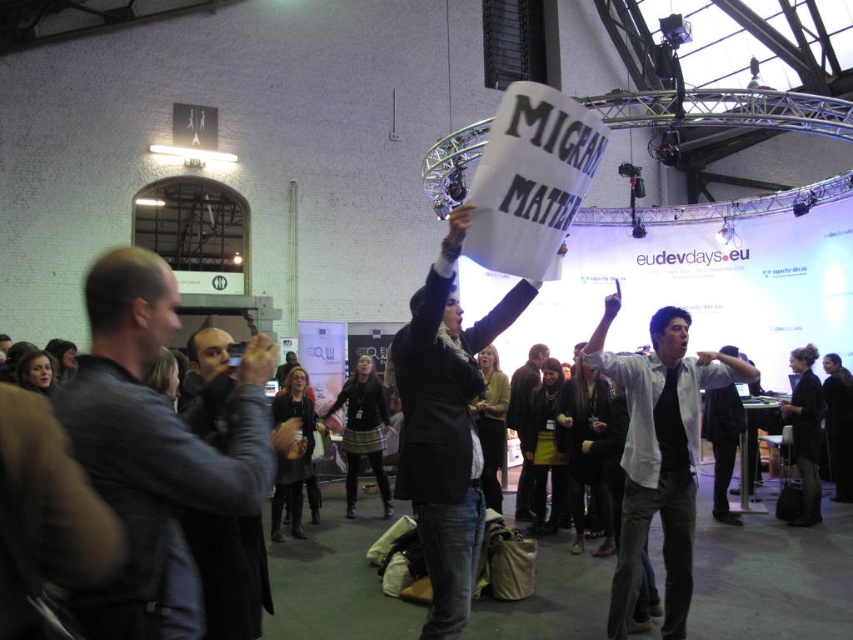
Does white shirt at center appear over dark gray leather jacket at left?

Correct, white shirt at center is located above dark gray leather jacket at left.

Which is above, white shirt at center or dark gray leather jacket at left?

white shirt at center is above.

Which is in front, point (665, 422) or point (196, 416)?

Point (196, 416) is in front.

I want to click on white shirt at center, so click(x=659, y=452).

Is white shirt at center in front of dark brown leather jacket at center?

That is True.

Who is more forward, (x=648, y=330) or (x=532, y=369)?

Point (x=648, y=330) is in front.

Who is more forward, (679, 332) or (520, 381)?

Point (679, 332) is more forward.

This screenshot has width=853, height=640. What are the coordinates of `white shirt at center` in the screenshot? It's located at (659, 452).

Is leather jacket at left positioned in front of dark gray leather jacket at left?

Yes, leather jacket at left is in front of dark gray leather jacket at left.

Is point (206, 506) farther from viewer compared to point (224, 611)?

No, it is in front of (224, 611).

What are the coordinates of `leather jacket at left` in the screenshot? It's located at (154, 449).

Identify the location of leather jacket at left. This screenshot has height=640, width=853. (154, 449).